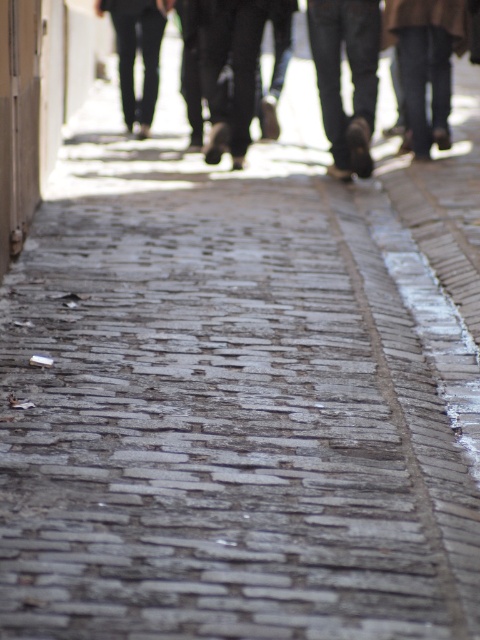
Does dark denim jeans at center appear on the right side of dark gray pants at center?

Yes, dark denim jeans at center is to the right of dark gray pants at center.

Who is lower down, dark denim jeans at center or dark gray pants at center?

dark denim jeans at center is lower down.

What do you see at coordinates (351, 76) in the screenshot? I see `dark denim jeans at center` at bounding box center [351, 76].

The image size is (480, 640). In order to click on dark denim jeans at center in this screenshot , I will do `click(351, 76)`.

Is brown leather shoes at upper center thinner than dark denim jeans at center?

No.

In the scene shown: Can you confirm if brown leather shoes at upper center is positioned to the right of dark denim jeans at center?

In fact, brown leather shoes at upper center is to the left of dark denim jeans at center.

Find the location of a particular element. brown leather shoes at upper center is located at coordinates (350, 74).

At what (x,y) coordinates should I click in order to perform the action: click on brown leather shoes at upper center. Please return your answer as a coordinate pair (x, y). This screenshot has width=480, height=640. Looking at the image, I should click on (350, 74).

Between brown leather shoes at upper center and dark gray pants at center, which one has more height?

brown leather shoes at upper center is taller.

Where is `brown leather shoes at upper center`? Image resolution: width=480 pixels, height=640 pixels. brown leather shoes at upper center is located at coordinates (350, 74).